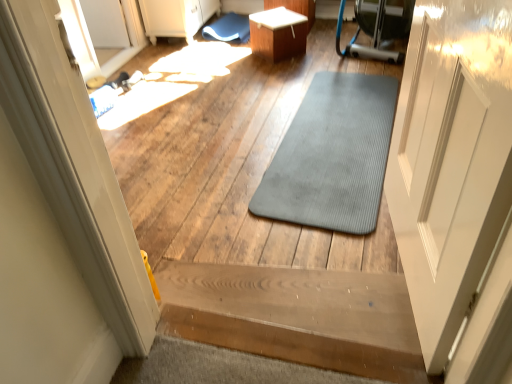
Identify the location of free space to the left of white glossy table at upper center. Image resolution: width=512 pixels, height=384 pixels. (236, 59).